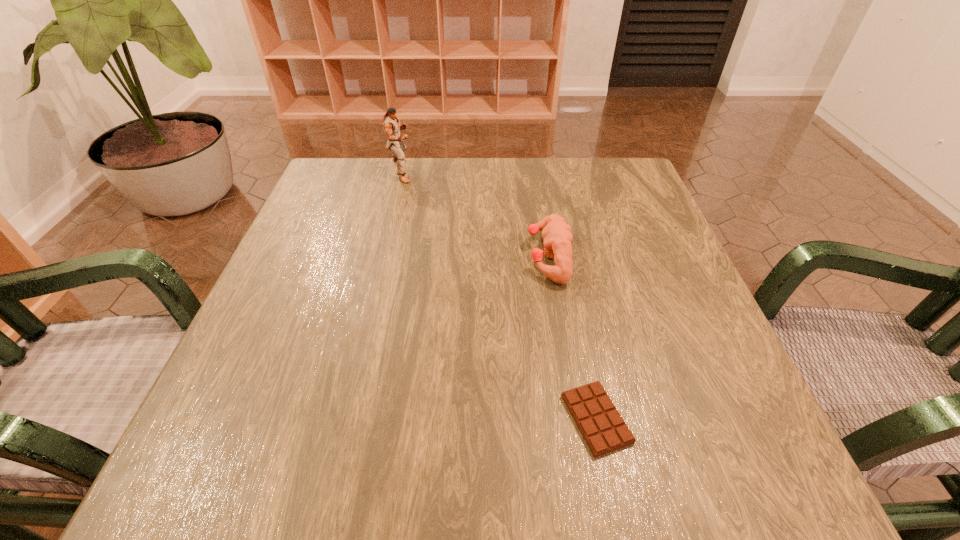
The image size is (960, 540). I want to click on the taller puncher, so click(x=391, y=125).

What are the coordinates of `the tallest object` in the screenshot? It's located at (391, 125).

Locate an element on the screen. The height and width of the screenshot is (540, 960). the right puncher is located at coordinates (557, 234).

The image size is (960, 540). I want to click on the second shortest object, so click(557, 234).

Image resolution: width=960 pixels, height=540 pixels. What are the coordinates of `the nearest object` in the screenshot? It's located at pos(604,430).

Identify the location of the shortest object. Image resolution: width=960 pixels, height=540 pixels. (604, 430).

Find the location of a particular element. This screenshot has height=540, width=960. vacant space positioned on the front-facing side of the left puncher is located at coordinates (566, 171).

Find the location of a particular element. This screenshot has height=540, width=960. free space located 0.290m with the gloves of the second shortest object facing forward is located at coordinates (386, 256).

You are a GUI agent. You are given a task and a screenshot of the screen. Output one action in this format:
    pyautogui.click(x=<x>, y=<y>)
    Task: Click on the vacant region located 0.210m with the gloves of the second shortest object facing forward
    
    Given the screenshot: What is the action you would take?
    pyautogui.click(x=424, y=256)

What are the coordinates of `free space located with the gloves of the second shortest object facing forward` in the screenshot? It's located at (371, 256).